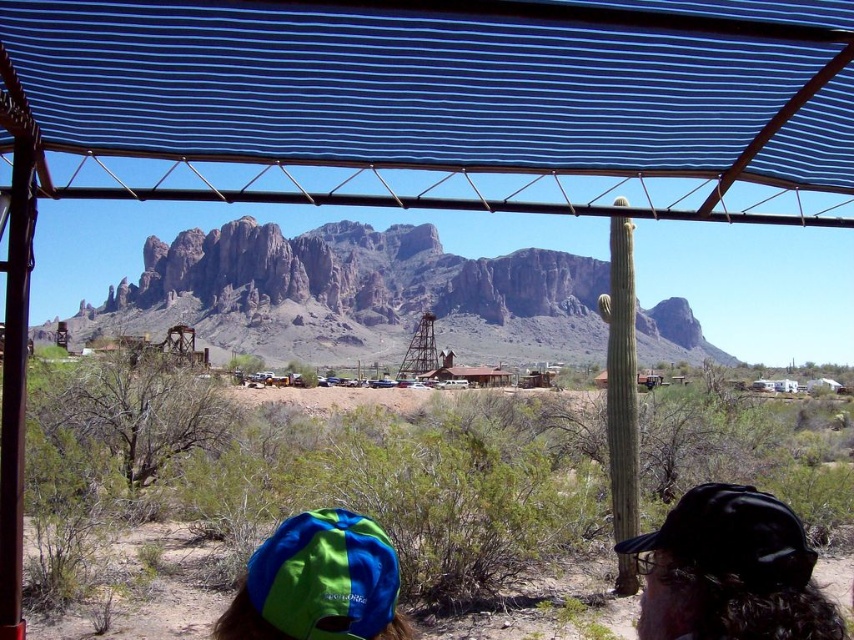
You are standing under the blue striped canopy at upper center and want to reach the nearest building in the small settlement in the background. The distance between you and the nearest building is 100 meters. Can you walk directly towards the building without leaving the desert area?

The blue striped canopy at upper center is 54.64 meters away from viewer. Since the nearest building is 100 meters away, you can walk directly towards it without leaving the desert area as the distance is sufficient.

You are standing under the blue striped canopy at upper center and want to take a photo of the mountain range in the background. Is the canopy blocking your view of the mountain range?

The blue striped canopy at upper center is located at point (443, 96), so it is positioned above and to the left of the center. This means it might partially block the view of the mountain range on the horizon, but since the mountain range is in the background and the canopy is above, you should still be able to see most of it by angling your camera downward slightly.

You are standing under the blue striped canopy at upper center and want to see the green fabric baseball hat at lower left. Is the hat visible from your current position?

The blue striped canopy at upper center is bigger than the green fabric baseball hat at lower left, but the description does not provide information about visibility. Therefore, it is unclear if the hat is visible from under the canopy.